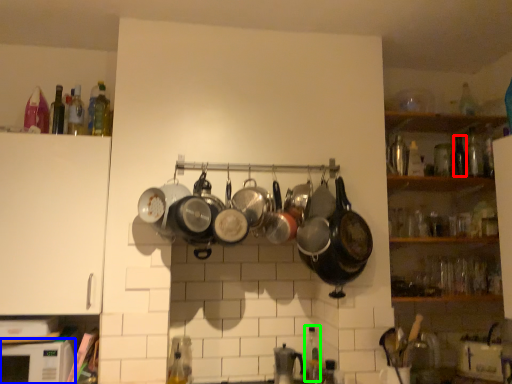
Question: Which object is the closest to the bottle (highlighted by a red box)? Choose among these: microwave (highlighted by a blue box) or bottle (highlighted by a green box).

Choices:
 (A) microwave
 (B) bottle

Answer: (B)